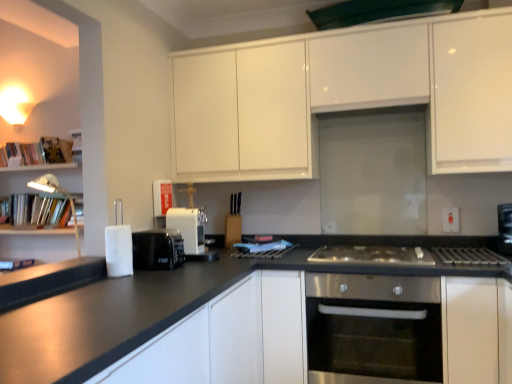
Question: Considering the positions of white glossy cabinet at upper center, marked as the 1th cabinetry in a top-to-bottom arrangement, and white matte cabinet at lower right, which appears as the 2th cabinetry when ordered from the bottom, in the image, is white glossy cabinet at upper center, marked as the 1th cabinetry in a top-to-bottom arrangement, bigger or smaller than white matte cabinet at lower right, which appears as the 2th cabinetry when ordered from the bottom,?

Choices:
 (A) big
 (B) small

Answer: (A)

Question: From the image's perspective, relative to white matte cabinet at lower right, the second cabinetry positioned from the top, is white glossy cabinet at upper center, acting as the third cabinetry starting from the bottom, above or below?

Choices:
 (A) below
 (B) above

Answer: (B)

Question: Estimate the real-world distances between objects in this image. Which object is farther from the white plastic lamp at left?

Choices:
 (A) stainless steel oven at center
 (B) hardcover books at left, the 1th book positioned from the bottom
 (C) white matte cabinet at center, the first cabinetry from the bottom
 (D) hardcover books at left, positioned as the 1th book in top-to-bottom order
 (E) white matte cabinet at lower right, the second cabinetry positioned from the top

Answer: (E)

Question: Estimate the real-world distances between objects in this image. Which object is farther from the white plastic lamp at left?

Choices:
 (A) stainless steel gas stove at center
 (B) green matte exhaust hood at upper center
 (C) hardcover books at left, the 2th book positioned from the top
 (D) white glossy cabinet at upper center, marked as the 1th cabinetry in a top-to-bottom arrangement
 (E) white plastic electric outlet at upper right

Answer: (E)